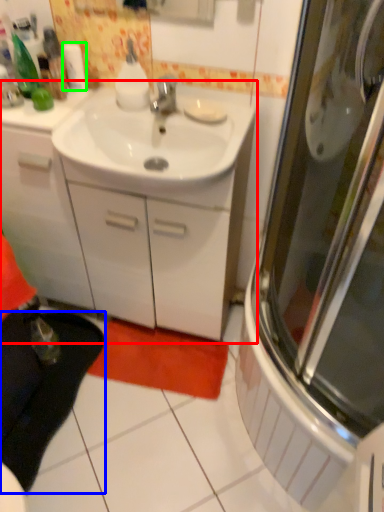
Question: Which object is the farthest from bathroom cabinet (highlighted by a red box)? Choose among these: carpets (highlighted by a blue box) or toilet paper (highlighted by a green box).

Choices:
 (A) carpets
 (B) toilet paper

Answer: (B)